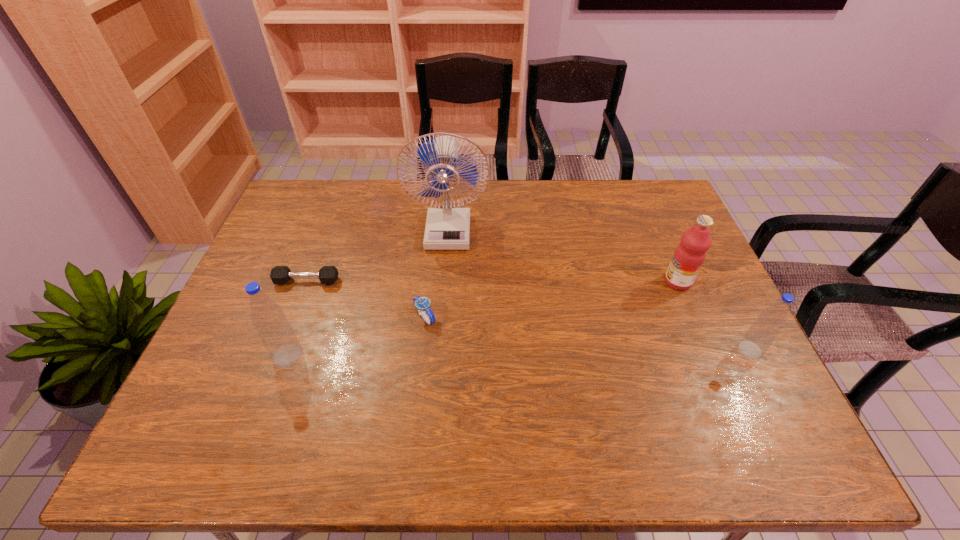
The image size is (960, 540). Find the location of `blank area located on the label of the fruit juice`. blank area located on the label of the fruit juice is located at coordinates (640, 282).

The width and height of the screenshot is (960, 540). I want to click on free space located 0.280m on the label of the fruit juice, so tap(567, 282).

Where is `vacant position located 0.180m on the label of the fruit juice`? The height and width of the screenshot is (540, 960). vacant position located 0.180m on the label of the fruit juice is located at coordinates (602, 282).

This screenshot has width=960, height=540. In order to click on free space located on the right of the watch in this screenshot , I will do `click(587, 317)`.

Where is `free space located 0.400m on the back of the dumbbell`? The width and height of the screenshot is (960, 540). free space located 0.400m on the back of the dumbbell is located at coordinates (340, 194).

The height and width of the screenshot is (540, 960). Identify the location of vacant space located on the front-facing side of the fan. (445, 264).

Where is `object at the far edge`? The image size is (960, 540). object at the far edge is located at coordinates [448, 227].

Where is `water bottle at the left edge`? The image size is (960, 540). water bottle at the left edge is located at coordinates (275, 332).

You are a GUI agent. You are given a task and a screenshot of the screen. Output one action in this format:
    pyautogui.click(x=<x>, y=<y>)
    Task: Click on the dumbbell that is at the left edge
    The width and height of the screenshot is (960, 540).
    Given the screenshot: What is the action you would take?
    pyautogui.click(x=280, y=274)

I want to click on water bottle that is at the right edge, so click(761, 334).